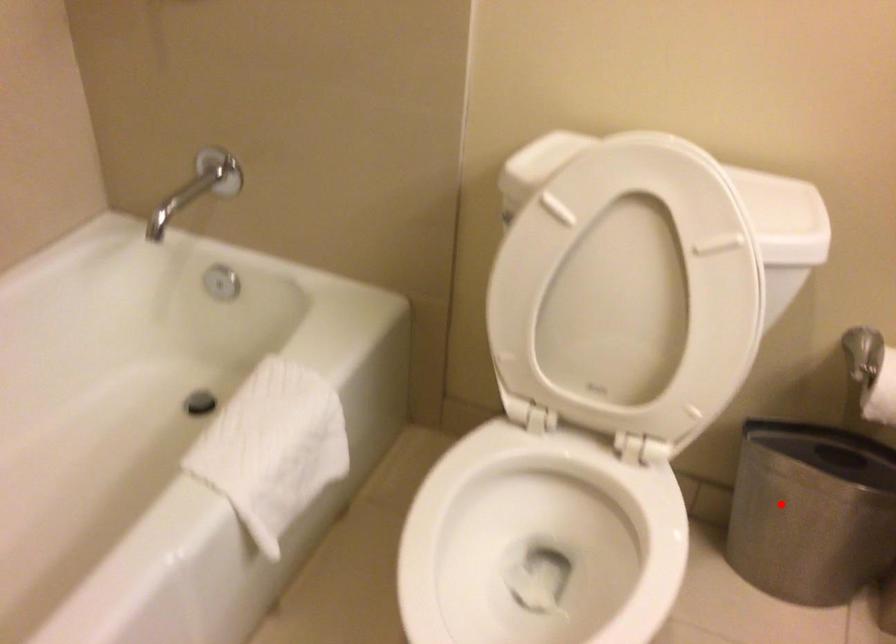
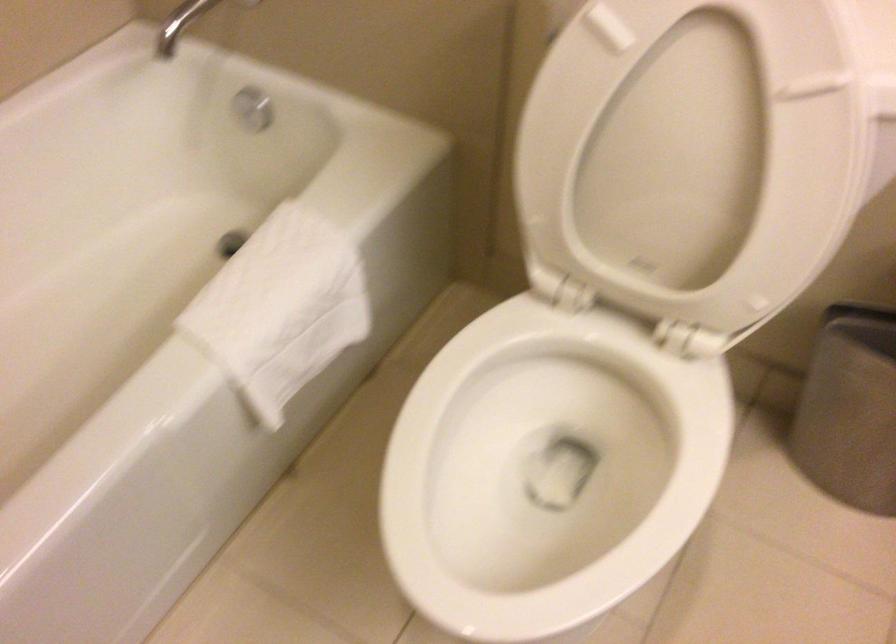
Question: I am providing you with two images of the same scene from different viewpoints. In image1, a red point is highlighted. Considering the same 3D point in image2, which of the following is correct?

Choices:
 (A) It is closer
 (B) It is farther

Answer: (A)